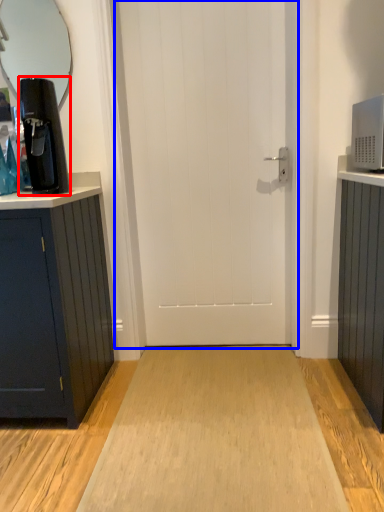
Question: Which point is closer to the camera, coffee machine (highlighted by a red box) or door (highlighted by a blue box)?

Choices:
 (A) coffee machine
 (B) door

Answer: (A)